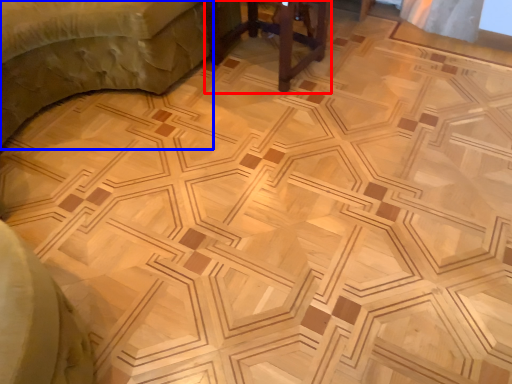
Question: Which object appears closest to the camera in this image, furniture (highlighted by a red box) or furniture (highlighted by a blue box)?

Choices:
 (A) furniture
 (B) furniture

Answer: (B)